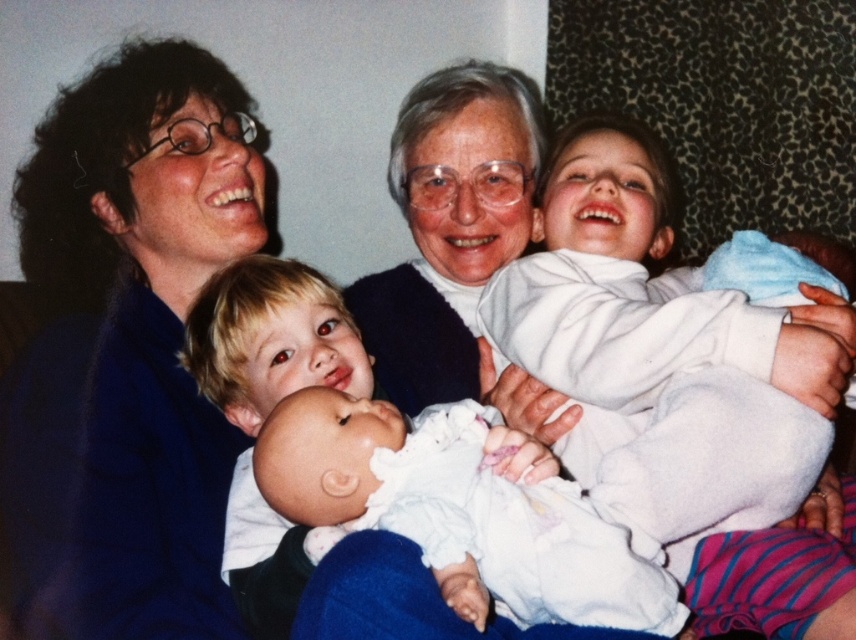
Is white soft cloth at upper right below white soft fabric baby at center?

Actually, white soft cloth at upper right is above white soft fabric baby at center.

Between white soft cloth at upper right and white soft fabric baby at center, which one is positioned lower?

white soft fabric baby at center is below.

I want to click on white soft cloth at upper right, so click(x=660, y=349).

Where is `white soft cloth at upper right`? The image size is (856, 640). white soft cloth at upper right is located at coordinates (660, 349).

Can you confirm if matte blue sweater at upper left is thinner than white soft cloth at upper right?

Incorrect, matte blue sweater at upper left's width is not less than white soft cloth at upper right's.

Who is more forward, (82, 256) or (589, 346)?

Point (589, 346) is in front.

At what (x,y) coordinates should I click in order to perform the action: click on matte blue sweater at upper left. Please return your answer as a coordinate pair (x, y). Looking at the image, I should click on (143, 323).

Where is `matte blue sweater at upper left`? This screenshot has height=640, width=856. matte blue sweater at upper left is located at coordinates (143, 323).

Does matte blue sweater at upper left appear on the right side of white soft fabric baby at center?

In fact, matte blue sweater at upper left is to the left of white soft fabric baby at center.

Is point (221, 189) farther from viewer compared to point (550, 612)?

Yes, point (221, 189) is farther from viewer.

Is point (256, 230) less distant than point (458, 476)?

No, (256, 230) is behind (458, 476).

Image resolution: width=856 pixels, height=640 pixels. In order to click on matte blue sweater at upper left in this screenshot , I will do `click(143, 323)`.